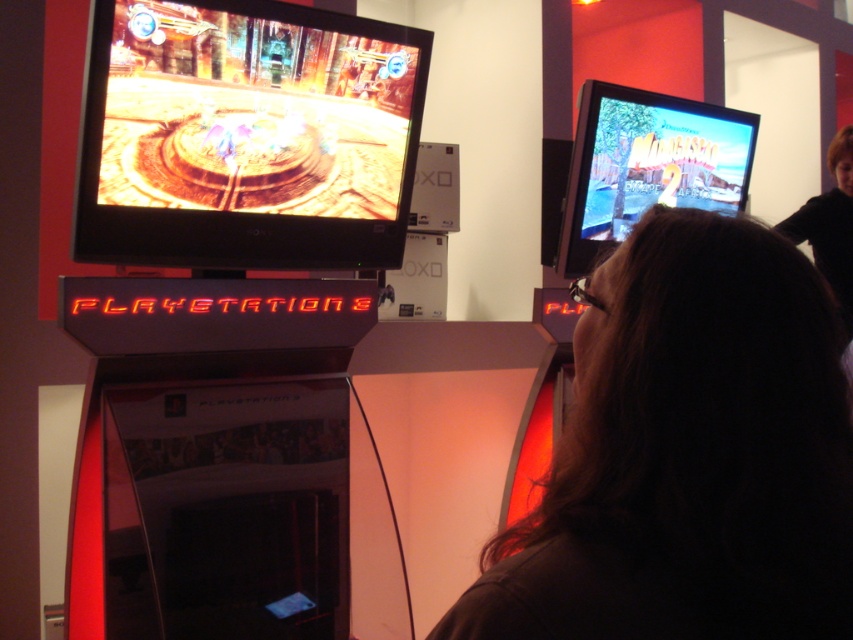
Between dark brown hair at center and shiny metallic tv at upper left, which one appears on the right side from the viewer's perspective?

Positioned to the right is dark brown hair at center.

Who is more distant from viewer, [567,612] or [88,125]?

The point [88,125] is more distant.

Locate an element on the screen. The image size is (853, 640). dark brown hair at center is located at coordinates (688, 452).